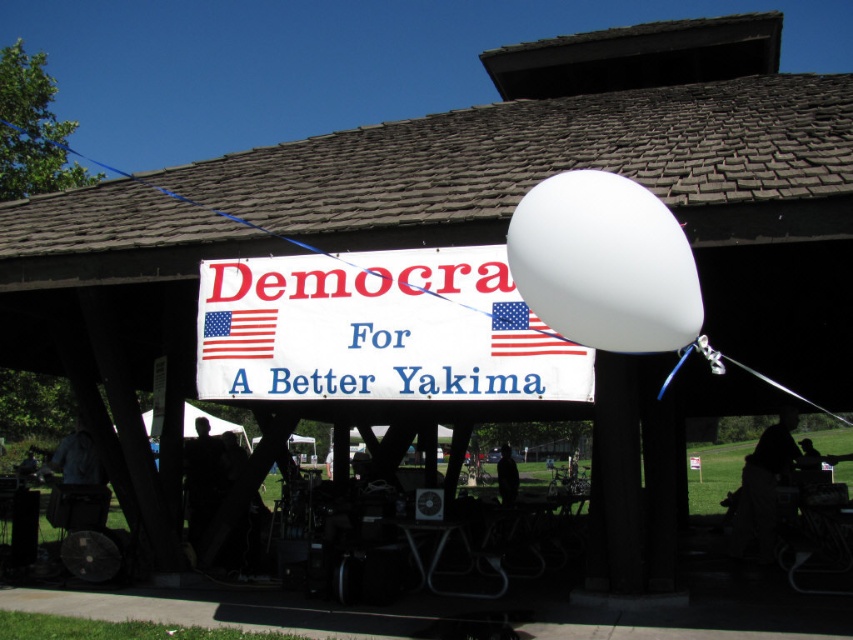
Question: In this image, where is white paper sign at center located relative to american flag at center?

Choices:
 (A) above
 (B) below

Answer: (A)

Question: Can you confirm if white paper sign at center is thinner than american flag at center?

Choices:
 (A) no
 (B) yes

Answer: (A)

Question: Which point is farther to the camera?

Choices:
 (A) (416, 289)
 (B) (525, 320)

Answer: (A)

Question: Does white paper sign at center appear on the left side of american flag at center?

Choices:
 (A) yes
 (B) no

Answer: (A)

Question: Which point is farther to the camera?

Choices:
 (A) (520, 326)
 (B) (505, 250)

Answer: (B)